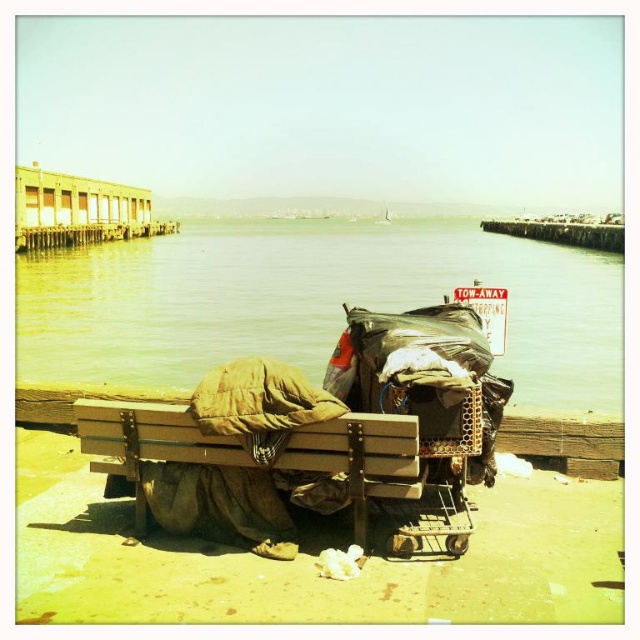
You are a delivery person needing to cross from the clear water at bench left to the brown wooden bench at lower center. Can you do so without getting wet?

The clear water at bench left and brown wooden bench at lower center are 31.49 meters apart from each other, so the distance is too large to cross without getting wet.

Consider the image. You are standing at the waterfront and see the clear water at bench left. Can you determine its exact location based on the coordinates provided?

The clear water at bench left is located at point coordinates of (310, 301).